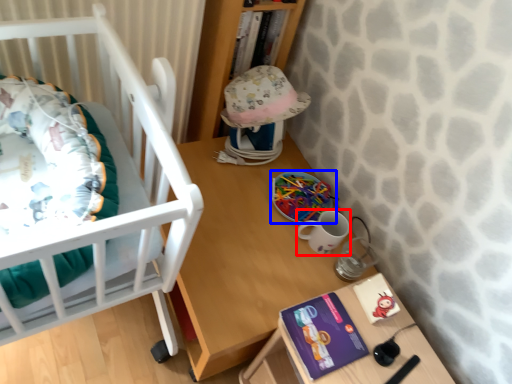
Question: Which of the following is the closest to the observer, mug (highlighted by a red box) or toy (highlighted by a blue box)?

Choices:
 (A) mug
 (B) toy

Answer: (A)